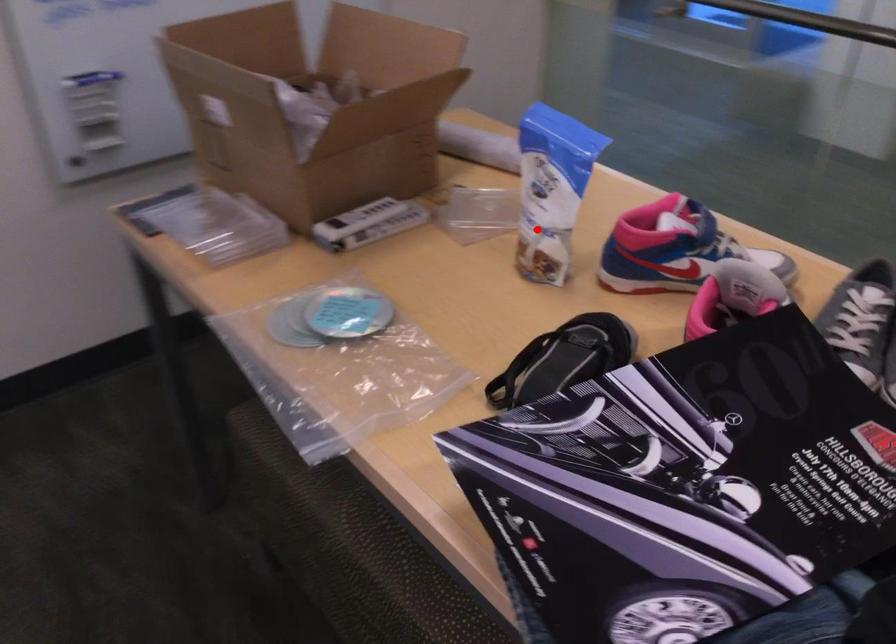
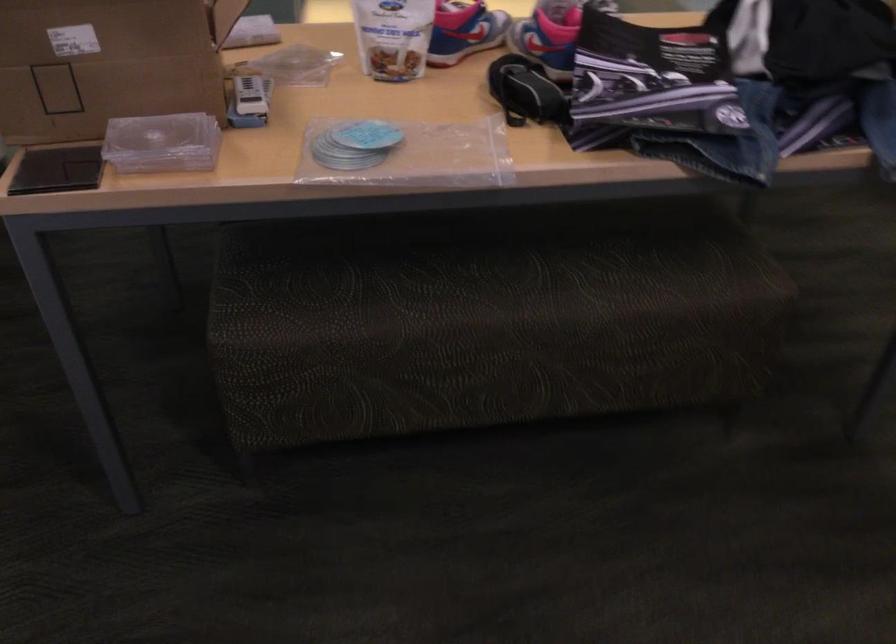
Find the pixel in the second image that matches the highlighted location in the first image.

(392, 37)